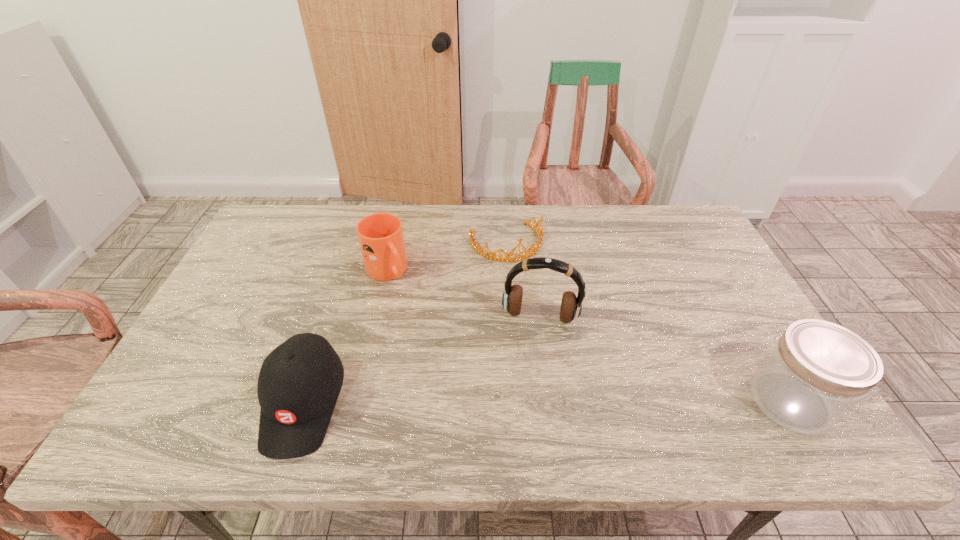
Find the location of a particular element. free space that is in between the mug and the tiara is located at coordinates (446, 257).

Identify the location of free space between the third nearest object and the jar. The height and width of the screenshot is (540, 960). (665, 359).

This screenshot has width=960, height=540. What are the coordinates of `vacant space in between the third farthest object and the tiara` in the screenshot? It's located at (523, 280).

Find the location of a particular element. free point between the rightmost object and the baseball cap is located at coordinates (547, 402).

I want to click on free area in between the fourth tallest object and the third farthest object, so click(x=421, y=360).

Locate an element on the screen. Image resolution: width=960 pixels, height=540 pixels. empty space that is in between the headset and the tiara is located at coordinates (523, 280).

At what (x,y) coordinates should I click in order to perform the action: click on vacant area between the baseball cap and the jar. Please return your answer as a coordinate pair (x, y). Looking at the image, I should click on tap(547, 402).

What are the coordinates of `empty space between the headset and the baseball cap` in the screenshot? It's located at (421, 360).

This screenshot has width=960, height=540. Identify the location of object that is the second closest to the jar. (540, 234).

Where is `object that is the nearest to the baseball cap`? This screenshot has height=540, width=960. object that is the nearest to the baseball cap is located at coordinates (380, 235).